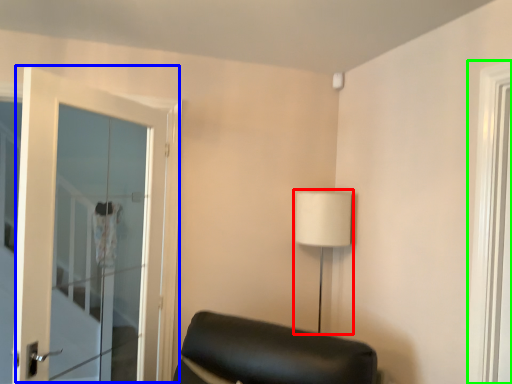
Question: Considering the real-world distances, which object is farthest from table lamp (highlighted by a red box)? door (highlighted by a blue box) or window (highlighted by a green box)?

Choices:
 (A) door
 (B) window

Answer: (A)